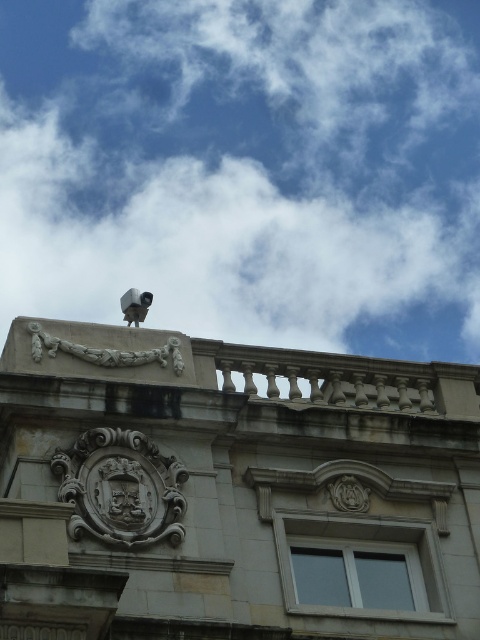
Can you confirm if white fluffy cloud at upper center is taller than white stone sculpture at upper center?

Yes.

Identify the location of white fluffy cloud at upper center. Image resolution: width=480 pixels, height=640 pixels. (245, 170).